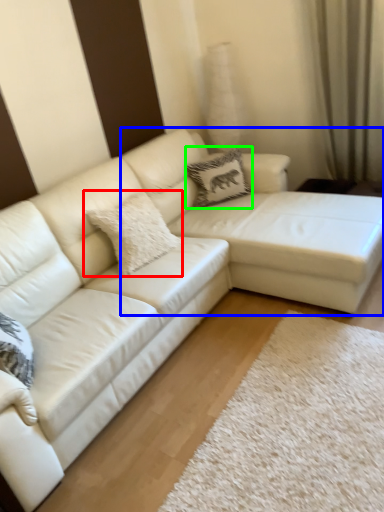
Question: Which object is positioned closest to pillow (highlighted by a red box)? Select from couch (highlighted by a blue box) and pillow (highlighted by a green box).

Choices:
 (A) couch
 (B) pillow

Answer: (A)